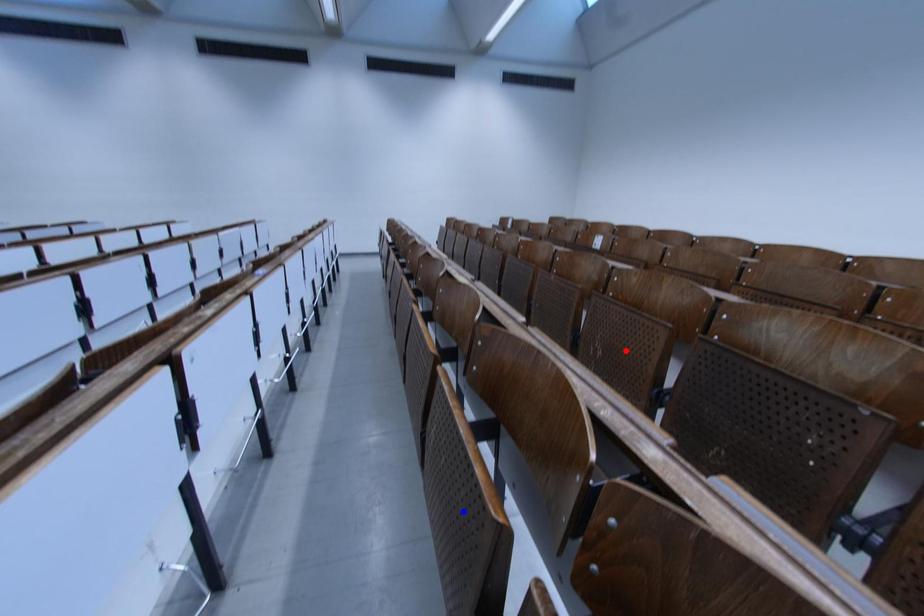
Question: In the image, two points are highlighted. Which point is nearer to the camera? Reply with the corresponding letter.

Choices:
 (A) blue point
 (B) red point

Answer: (A)